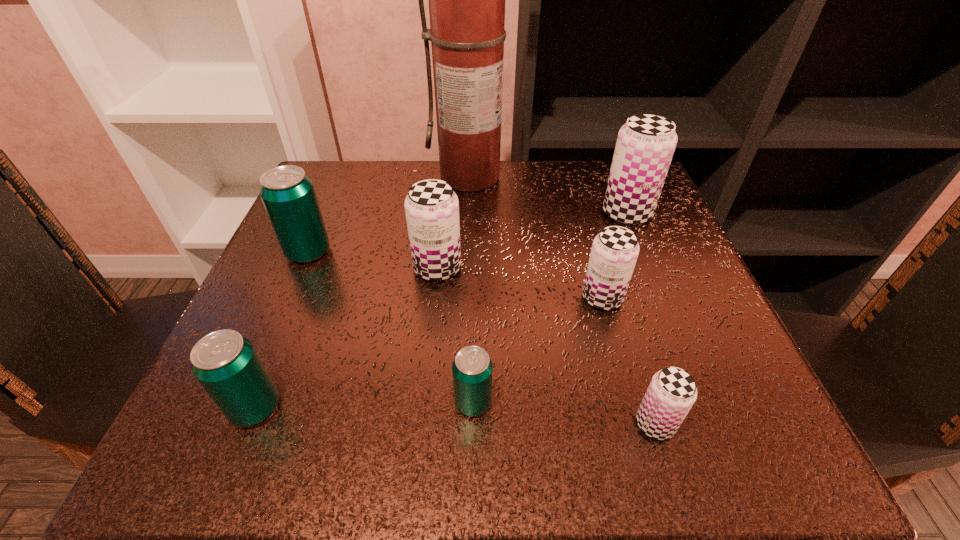
You are a GUI agent. You are given a task and a screenshot of the screen. Output one action in this format:
    pyautogui.click(x=<x>, y=<y>)
    Task: Click on the free space that is in between the rightmost teal beer can and the farthest object
    
    Given the screenshot: What is the action you would take?
    pyautogui.click(x=472, y=289)

Find the location of a particular element. The height and width of the screenshot is (540, 960). vacant area between the fire extinguisher and the rightmost teal beer can is located at coordinates (472, 289).

Identify the location of free spot between the third biggest purple beer can and the smallest purple beer can. (629, 361).

Where is `free space between the nearest purple beer can and the smallest teal beer can`? free space between the nearest purple beer can and the smallest teal beer can is located at coordinates (564, 413).

Where is `vacant space in between the second smallest teal beer can and the seventh shortest object`? This screenshot has width=960, height=540. vacant space in between the second smallest teal beer can and the seventh shortest object is located at coordinates click(441, 310).

Find the location of a particular element. The image size is (960, 540). vacant point located between the second biggest teal beer can and the leftmost purple beer can is located at coordinates (347, 338).

This screenshot has width=960, height=540. Find the location of `empty space between the second biggest teal beer can and the third smallest purple beer can`. empty space between the second biggest teal beer can and the third smallest purple beer can is located at coordinates (347, 338).

You are a GUI agent. You are given a task and a screenshot of the screen. Output one action in this format:
    pyautogui.click(x=<x>, y=<y>)
    Task: Click on the object that is the fourth closest one to the nearest purple beer can
    
    Given the screenshot: What is the action you would take?
    pyautogui.click(x=645, y=145)

You are a GUI agent. You are given a task and a screenshot of the screen. Output one action in this format:
    pyautogui.click(x=<x>, y=<y>)
    Task: Click on the object that stands as the fifth closest to the farthest object
    This screenshot has height=540, width=960.
    Given the screenshot: What is the action you would take?
    pyautogui.click(x=472, y=369)

Locate an element on the screen. beer can that is the closest to the smallest purple beer can is located at coordinates (615, 250).